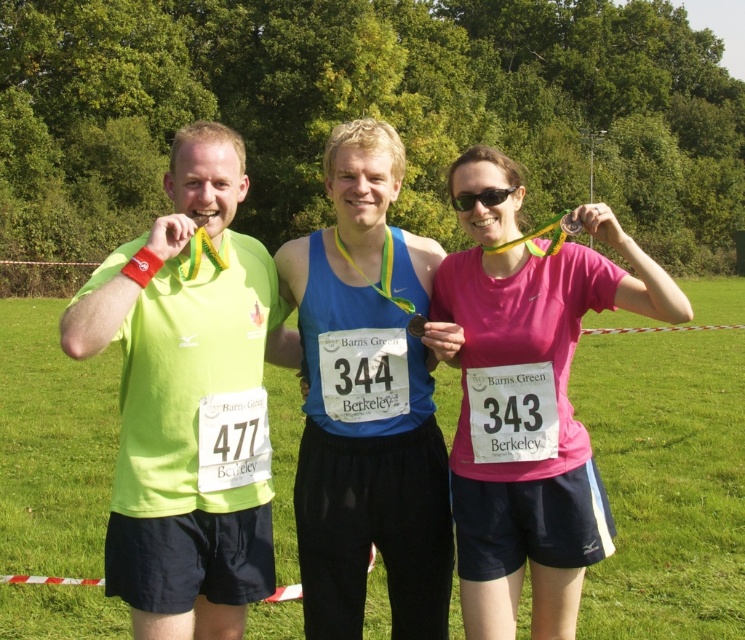
You are a photographer positioned behind the runners. You want to take a photo that includes both the matte green shirt at left and the blue fabric tank top at center. Which runner should you focus on first to ensure both are in frame?

You should focus on the matte green shirt at left first because it is in front of the blue fabric tank top at center, so capturing it first ensures both are visible in the photo.

You are a photographer trying to capture a group photo of the matte green shirt at left and the blue fabric tank top at center. Since you want to ensure both are clearly visible, which one should you focus on to avoid blurriness due to their size in the frame?

The blue fabric tank top at center is larger in the frame than the matte green shirt at left, so focusing on the blue fabric tank top at center would ensure both are in focus as it is the larger object.